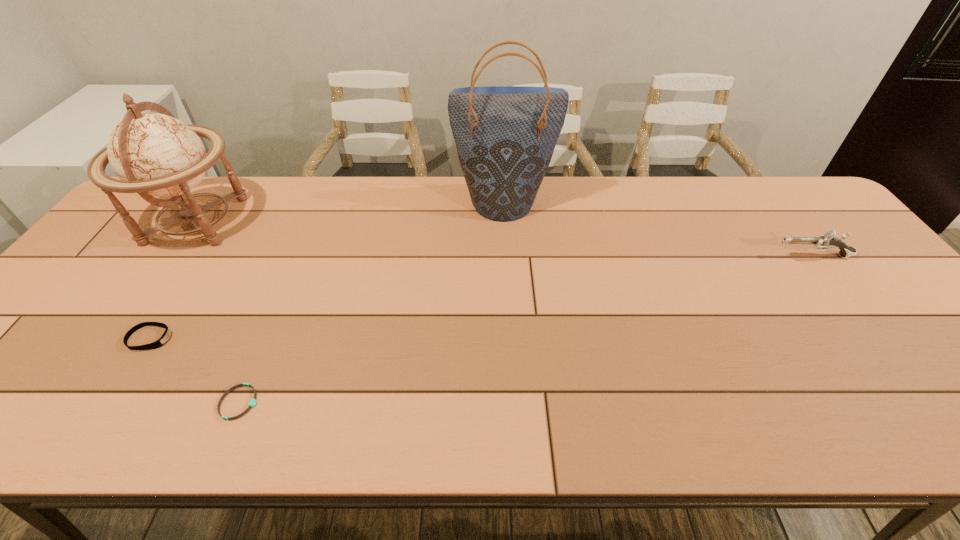
The image size is (960, 540). In order to click on free space between the nearest object and the fourth shortest object in this screenshot , I will do `click(218, 312)`.

This screenshot has width=960, height=540. In order to click on free spot between the tallest object and the fourth shortest object in this screenshot , I will do `click(350, 211)`.

Locate an element on the screen. Image resolution: width=960 pixels, height=540 pixels. free space between the rightmost object and the right wristband is located at coordinates 526,329.

Find the location of a particular element. The width and height of the screenshot is (960, 540). free space between the second tallest object and the farther wristband is located at coordinates click(173, 280).

The image size is (960, 540). I want to click on unoccupied position between the second object from right to left and the globe, so click(350, 211).

Identify the location of object that ranks as the closest to the globe. (162, 340).

The width and height of the screenshot is (960, 540). I want to click on object that is the fourth closest to the taller wristband, so click(827, 241).